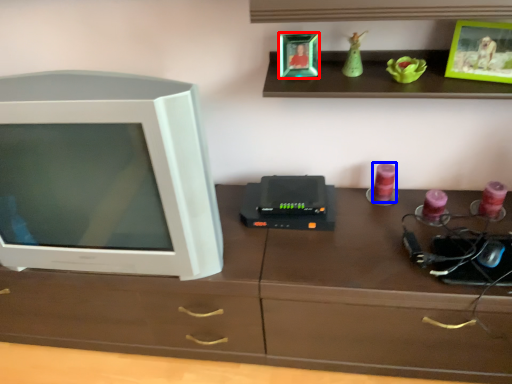
Question: Which object appears farthest to the camera in this image, picture frame (highlighted by a red box) or candle (highlighted by a blue box)?

Choices:
 (A) picture frame
 (B) candle

Answer: (B)